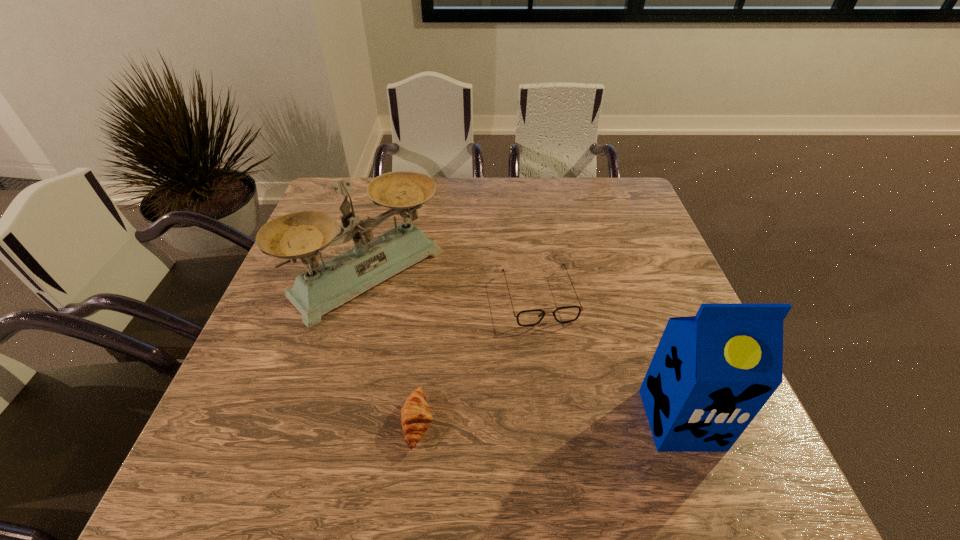
At what (x,y) coordinates should I click in order to perform the action: click on free space on the desktop that is between the pastry and the tallest object and is positioned on the front-facing side of the scale. Please return your answer as a coordinate pair (x, y). Looking at the image, I should click on (532, 421).

Where is `free spot on the desktop that is between the shortest object and the rightmost object and is positioned on the front-facing side of the sunglasses`? Image resolution: width=960 pixels, height=540 pixels. free spot on the desktop that is between the shortest object and the rightmost object and is positioned on the front-facing side of the sunglasses is located at coordinates (577, 421).